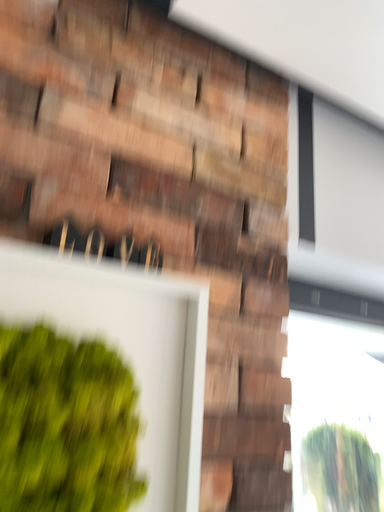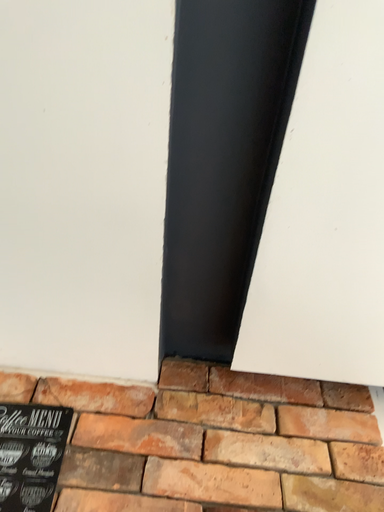
Question: How did the camera likely rotate when shooting the video?

Choices:
 (A) rotated upward
 (B) rotated downward

Answer: (A)